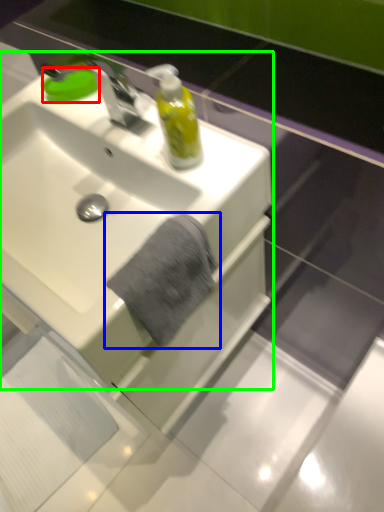
Question: Considering the real-world distances, which object is closest to soap (highlighted by a red box)? bath towel (highlighted by a blue box) or sink (highlighted by a green box).

Choices:
 (A) bath towel
 (B) sink

Answer: (B)